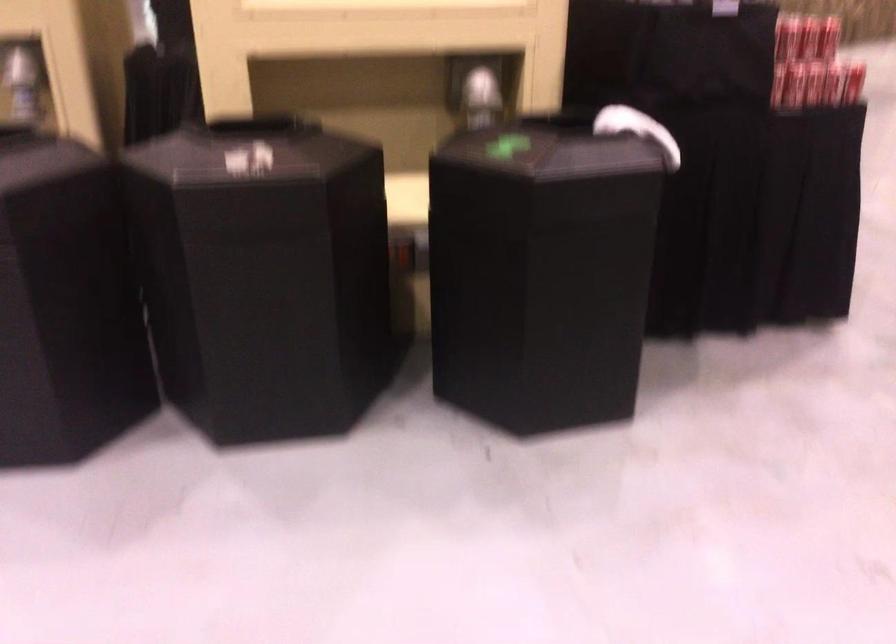
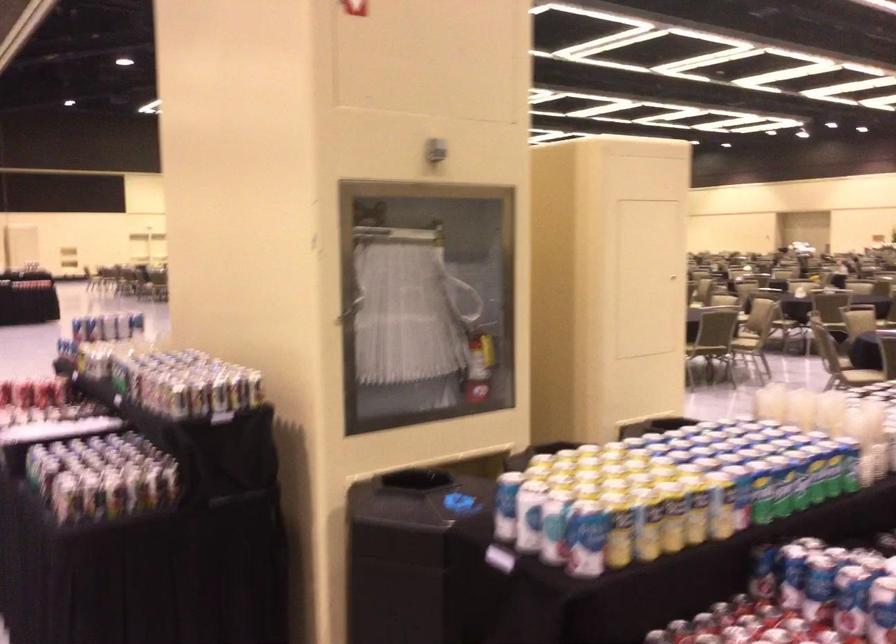
Question: I am providing you with two images of the same scene from different viewpoints. After the viewpoint changes to image2, which objects are now occluded?

Choices:
 (A) cloth tote bag
 (B) red fire extinguisher
 (C) white towel
 (D) trash can opening

Answer: (C)